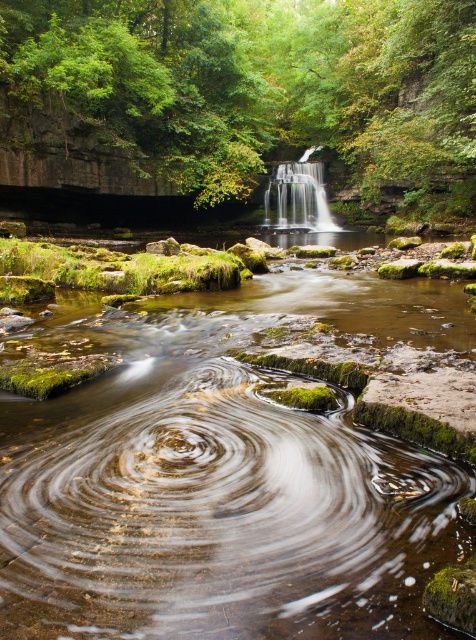
Can you confirm if green leafy forest at upper center is bigger than white silky waterfall at center?

Indeed, green leafy forest at upper center has a larger size compared to white silky waterfall at center.

The image size is (476, 640). In order to click on green leafy forest at upper center in this screenshot , I will do `click(264, 84)`.

Identify the location of green leafy forest at upper center. This screenshot has width=476, height=640. (264, 84).